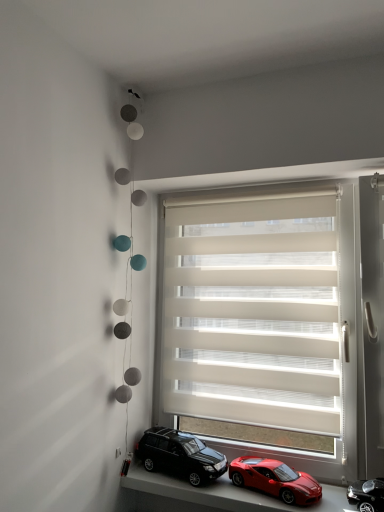
Locate an element on the screen. This screenshot has height=512, width=384. blank space situated above smooth plastic toy cars at lower center (from a real-world perspective) is located at coordinates (242, 487).